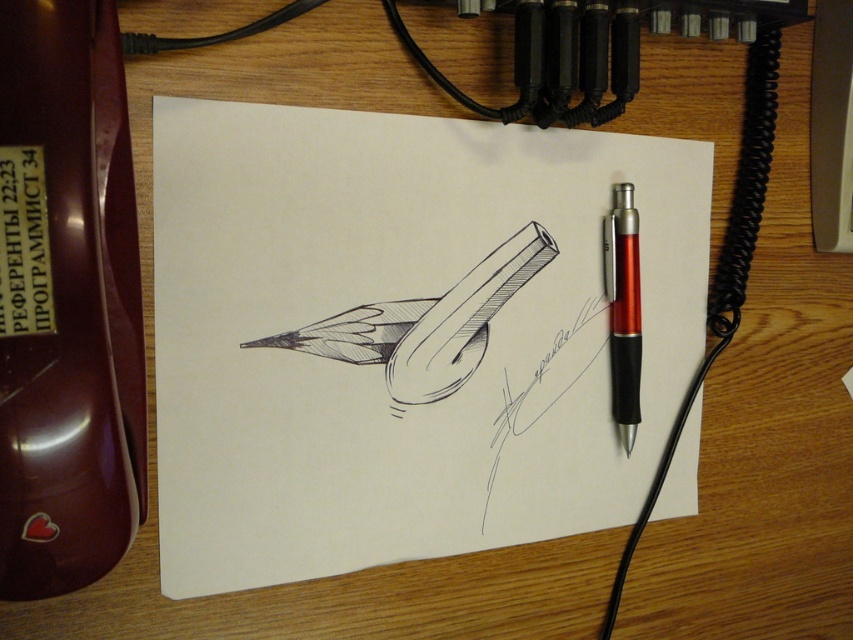
Does white paper at center appear under translucent red pen at right?

Yes.

Is white paper at center in front of translucent red pen at right?

That is True.

Does point (337, 212) lie behind point (625, 416)?

No.

Where is `white paper at center`? This screenshot has width=853, height=640. white paper at center is located at coordinates pos(401,333).